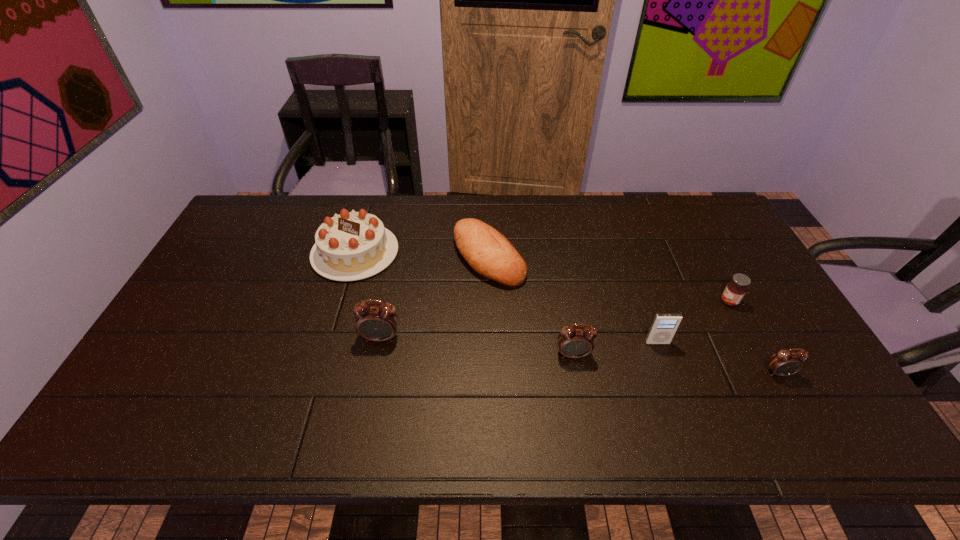
What are the coordinates of `free space located on the face of the tallest alarm clock` in the screenshot? It's located at (371, 392).

Locate an element on the screen. This screenshot has height=540, width=960. vacant space located 0.080m on the face of the second alarm clock from left to right is located at coordinates (579, 388).

Locate an element on the screen. free space located on the label side of the jam is located at coordinates (606, 302).

Image resolution: width=960 pixels, height=540 pixels. Find the location of `free space located on the label side of the jam`. free space located on the label side of the jam is located at coordinates (651, 302).

Find the location of a particular element. free space located 0.060m on the label side of the jam is located at coordinates (700, 302).

The image size is (960, 540). Find the location of `free space located 0.060m on the left of the third object from left to right`. free space located 0.060m on the left of the third object from left to right is located at coordinates (434, 257).

Where is `vacant position located 0.140m on the right of the birthday cake`? This screenshot has height=540, width=960. vacant position located 0.140m on the right of the birthday cake is located at coordinates (442, 252).

Where is `vacant area situated on the front-facing side of the iPod`? The width and height of the screenshot is (960, 540). vacant area situated on the front-facing side of the iPod is located at coordinates (669, 377).

Find the location of a particular element. The height and width of the screenshot is (540, 960). bread that is positioned at the far edge is located at coordinates (490, 254).

Find the location of `birthday cake that is at the far edge`. birthday cake that is at the far edge is located at coordinates (351, 246).